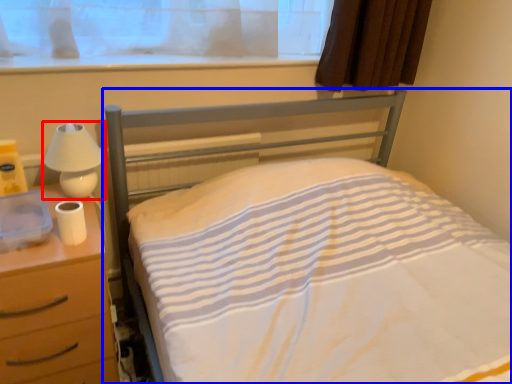
Question: Which point is further to the camera, lamp (highlighted by a red box) or bed (highlighted by a blue box)?

Choices:
 (A) lamp
 (B) bed

Answer: (A)